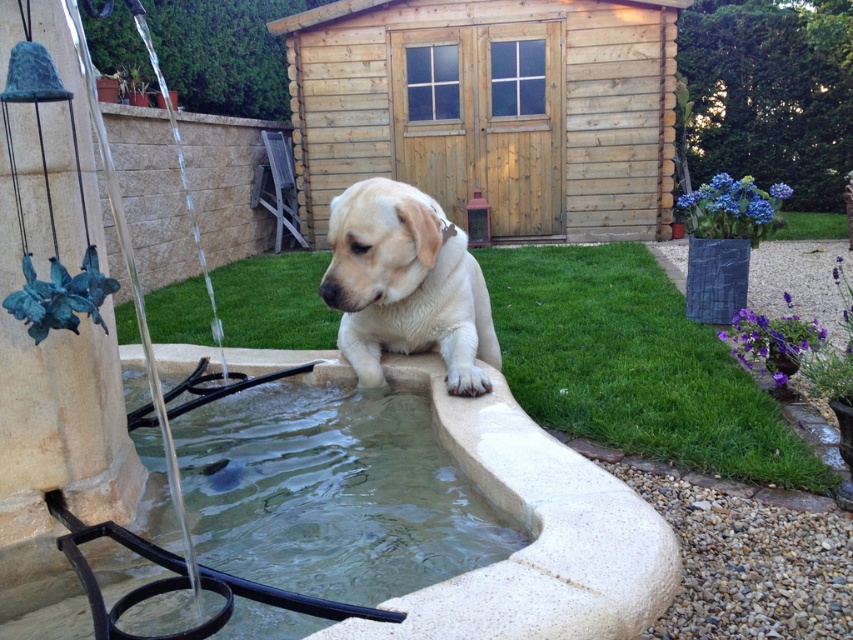
Question: Which point is closer to the camera taking this photo?

Choices:
 (A) (604, 205)
 (B) (410, 205)
 (C) (300, 416)

Answer: (B)

Question: Which object is farther from the camera taking this photo?

Choices:
 (A) light beige fur at center
 (B) clear glass water at lower center
 (C) wooden shed at center

Answer: (C)

Question: Can you confirm if clear glass water at lower center is positioned above light beige fur at center?

Choices:
 (A) yes
 (B) no

Answer: (B)

Question: Which object is the closest to the clear glass water at lower center?

Choices:
 (A) wooden shed at center
 (B) light beige fur at center

Answer: (B)

Question: From the image, what is the correct spatial relationship of clear glass water at lower center in relation to light beige fur at center?

Choices:
 (A) below
 (B) above

Answer: (A)

Question: Observing the image, what is the correct spatial positioning of clear glass water at lower center in reference to light beige fur at center?

Choices:
 (A) above
 (B) below

Answer: (B)